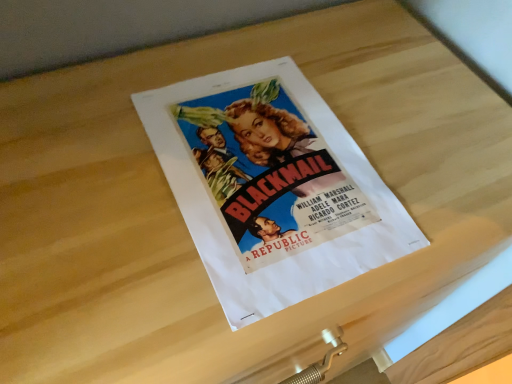
Identify the location of vacant space in matte paper poster at center (from a real-world perspective). (281, 215).